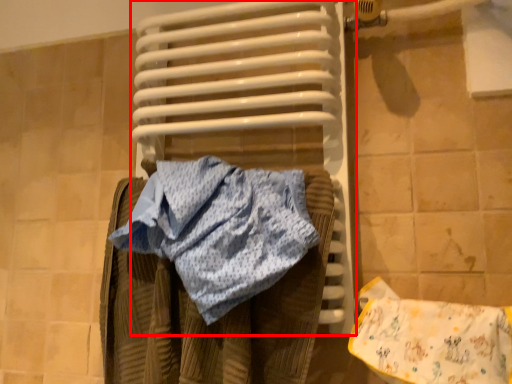
Question: From the image's perspective, where is water heater (annotated by the red box) located relative to material?

Choices:
 (A) below
 (B) above

Answer: (B)